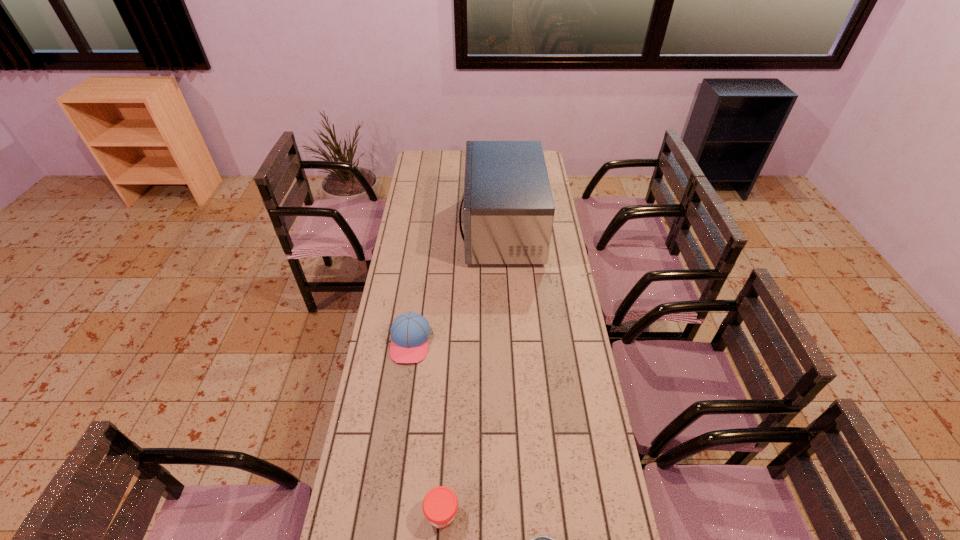
In order to click on vacant space that satisfies the following two spatial constraints: 1. on the front-facing side of the farthest object; 2. on the front-facing side of the leftmost object in this screenshot , I will do `click(509, 342)`.

The width and height of the screenshot is (960, 540). I want to click on vacant point that satisfies the following two spatial constraints: 1. on the front-facing side of the farthest object; 2. on the front-facing side of the baseball cap, so click(x=509, y=342).

Locate an element on the screen. free space that satisfies the following two spatial constraints: 1. on the front-facing side of the tallest object; 2. on the front-facing side of the second farthest object is located at coordinates (509, 342).

You are a GUI agent. You are given a task and a screenshot of the screen. Output one action in this format:
    pyautogui.click(x=<x>, y=<y>)
    Task: Click on the free point that satisfies the following two spatial constraints: 1. on the front-facing side of the microwave oven; 2. on the front-facing side of the second tallest object
    Image resolution: width=960 pixels, height=540 pixels.
    Given the screenshot: What is the action you would take?
    pyautogui.click(x=509, y=342)

Image resolution: width=960 pixels, height=540 pixels. Identify the location of free space in the image that satisfies the following two spatial constraints: 1. on the front-facing side of the tallest object; 2. on the front-facing side of the second tallest object. (509, 342).

Image resolution: width=960 pixels, height=540 pixels. What are the coordinates of `free location that satisfies the following two spatial constraints: 1. on the front-facing side of the farthest object; 2. on the front-facing side of the second tallest object` in the screenshot? It's located at (509, 342).

The image size is (960, 540). In order to click on free spot that satisfies the following two spatial constraints: 1. on the front-facing side of the farthest object; 2. on the front-facing side of the leftmost object in this screenshot , I will do `click(509, 342)`.